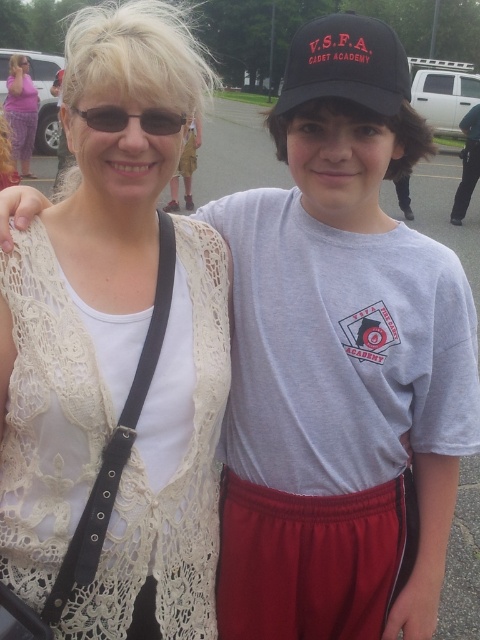
Is point (363, 54) closer to camera compared to point (32, 90)?

Yes, point (363, 54) is closer to viewer.

What do you see at coordinates (346, 65) in the screenshot? The width and height of the screenshot is (480, 640). I see `black matte baseball cap at upper center` at bounding box center [346, 65].

At what (x,y) coordinates should I click in order to perform the action: click on black matte baseball cap at upper center. Please return your answer as a coordinate pair (x, y). The height and width of the screenshot is (640, 480). Looking at the image, I should click on (346, 65).

Identify the location of black matte baseball cap at upper center. (346, 65).

Is white lace vest at upper left positioned behind matte black sunglasses at upper left?

Yes.

You are a GUI agent. You are given a task and a screenshot of the screen. Output one action in this format:
    pyautogui.click(x=<x>, y=<y>)
    Task: Click on the white lace vest at upper left
    The image size is (480, 640).
    Given the screenshot: What is the action you would take?
    pyautogui.click(x=117, y=353)

Is point (12, 332) in front of point (124, 113)?

That is False.

Where is `white lace vest at upper left`? white lace vest at upper left is located at coordinates (117, 353).

Which is more to the right, white lace vest at upper left or matte purple dress at upper left?

Positioned to the right is white lace vest at upper left.

Describe the element at coordinates (117, 353) in the screenshot. I see `white lace vest at upper left` at that location.

Locate an element on the screen. white lace vest at upper left is located at coordinates (117, 353).